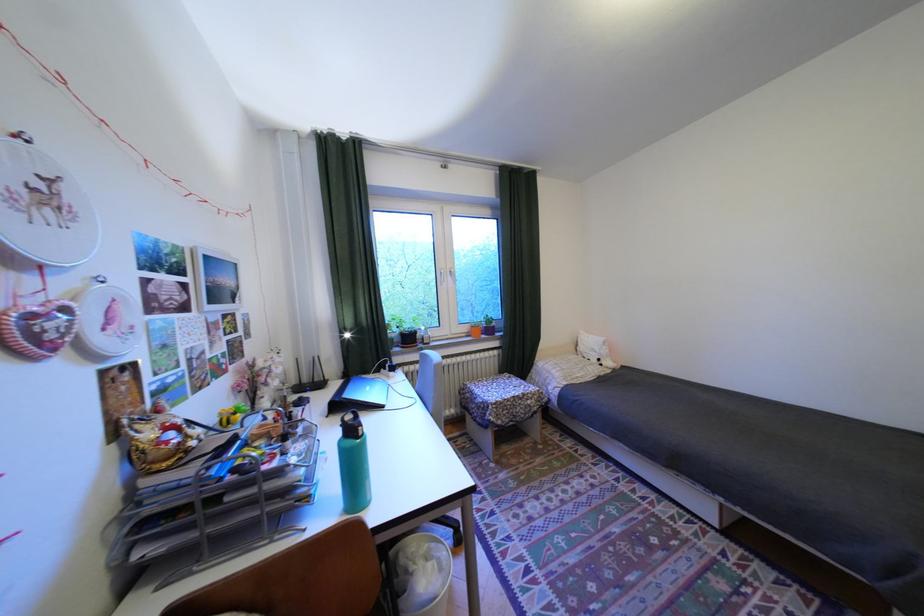
The height and width of the screenshot is (616, 924). I want to click on green curtain, so click(x=350, y=253).